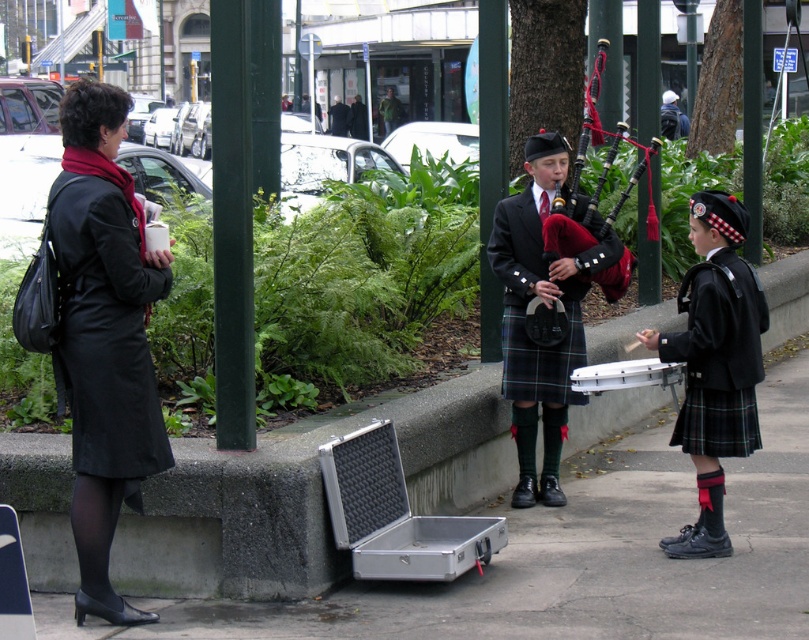
Does metallic case at lower center lie in front of plaid fabric skirt at lower right?

Yes.

I want to click on metallic case at lower center, so click(575, 554).

Who is positioned more to the right, plaid fabric skirt at lower right or metallic silver case at center?

Positioned to the right is plaid fabric skirt at lower right.

In the scene shown: Does plaid fabric skirt at lower right have a smaller size compared to metallic silver case at center?

No.

Does point (754, 300) lie behind point (663, 376)?

Yes, point (754, 300) is behind point (663, 376).

You are a GUI agent. You are given a task and a screenshot of the screen. Output one action in this format:
    pyautogui.click(x=<x>, y=<y>)
    Task: Click on the plaid fabric skirt at lower right
    This screenshot has height=640, width=809.
    Given the screenshot: What is the action you would take?
    pyautogui.click(x=718, y=356)

Can you confirm if green plaid kilt at lower right is positioned below green fabric jacket at center?

Correct, green plaid kilt at lower right is located below green fabric jacket at center.

Is green plaid kilt at lower right further to the viewer compared to green fabric jacket at center?

No, green plaid kilt at lower right is in front of green fabric jacket at center.

Does point (727, 412) come behind point (384, 131)?

No, it is in front of (384, 131).

Identify the location of green plaid kilt at lower right. (718, 422).